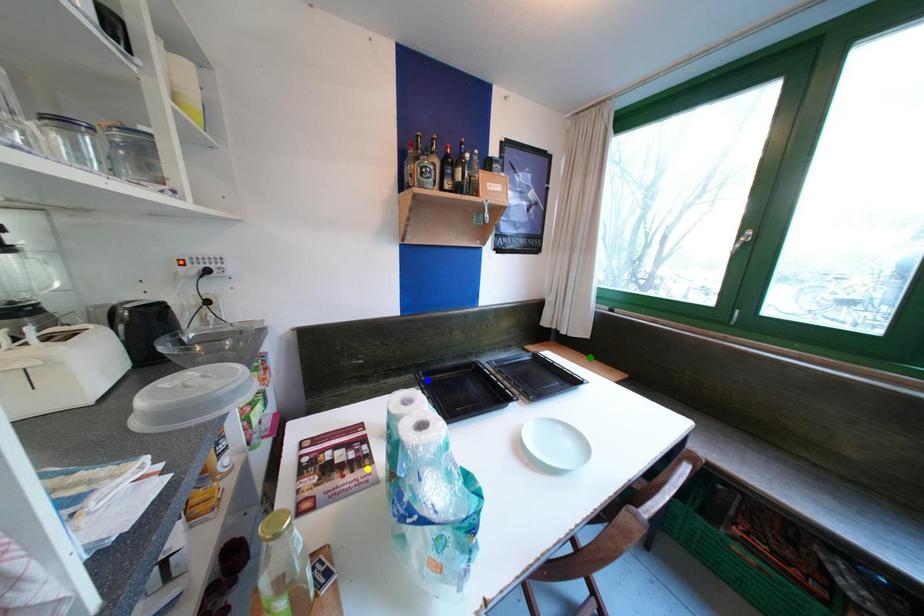
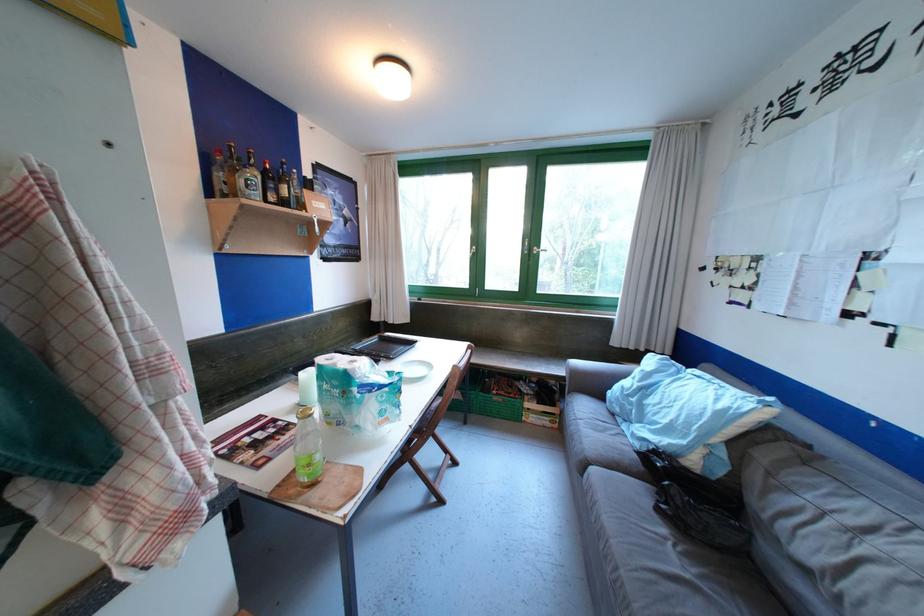
I am providing you with two images of the same scene from different viewpoints. Three points are marked in image1. Which point corresponds to a part or object that is occluded in image2?In image1, three points are marked. Which of them correspond to a part or object that is occluded in image2?Among the three points shown in image1, which one corresponds to a part or object that is no longer visible due to occlusion in image2?

green point, blue point